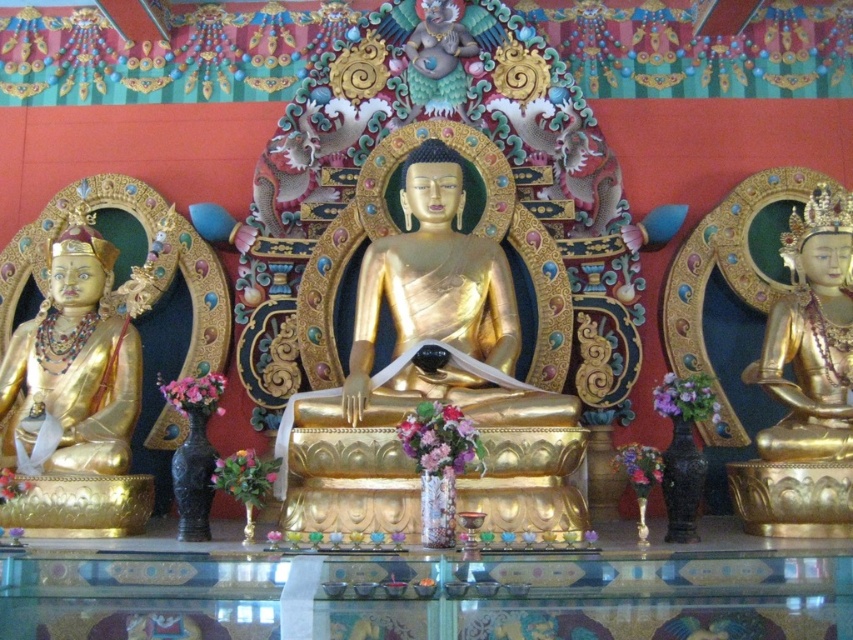
Question: Can you confirm if gold polished statue at center is positioned to the left of gold/gilded statue at left?

Choices:
 (A) yes
 (B) no

Answer: (B)

Question: Among these points, which one is farthest from the camera?

Choices:
 (A) tap(51, 321)
 (B) tap(833, 209)
 (C) tap(392, 280)

Answer: (B)

Question: Does gold polished statue at center appear on the left side of gold/gilded statue at left?

Choices:
 (A) no
 (B) yes

Answer: (A)

Question: Can you confirm if gold/gilded statue at left is thinner than gold polished statue at right?

Choices:
 (A) yes
 (B) no

Answer: (B)

Question: Which object is closer to the camera taking this photo?

Choices:
 (A) gold/gilded statue at left
 (B) gold polished statue at center

Answer: (B)

Question: Which point is farther to the camera?

Choices:
 (A) gold polished statue at center
 (B) gold/gilded statue at left
 (C) gold polished statue at right

Answer: (C)